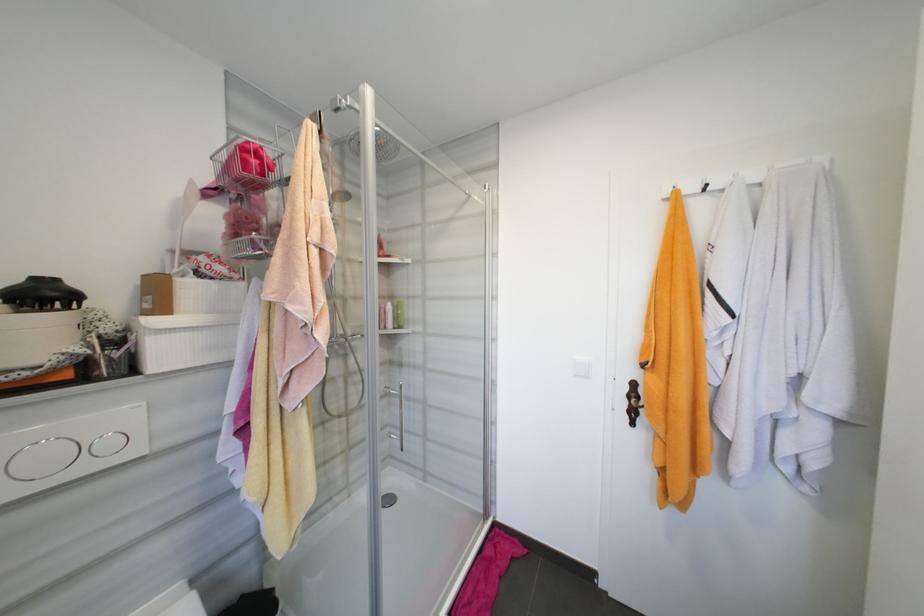
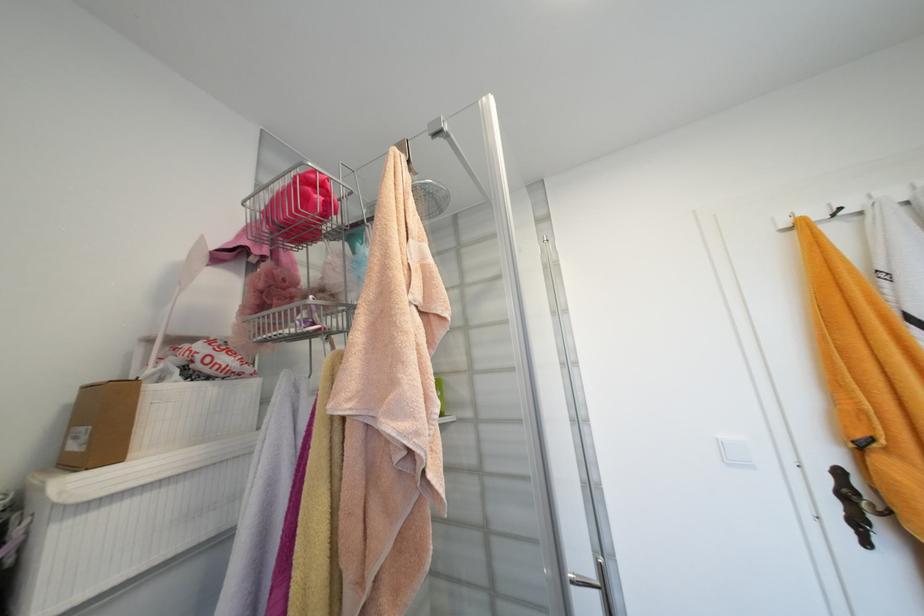
In the second image, find the point that corresponds to point 748,172 in the first image.

(885, 193)